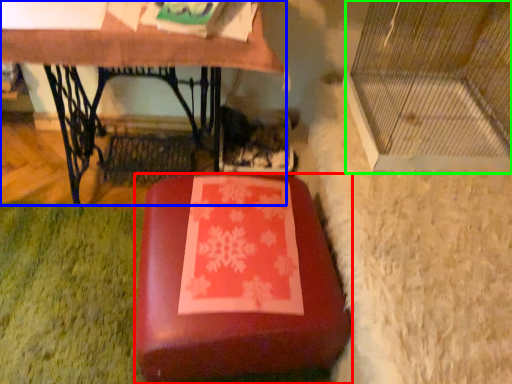
Question: Based on their relative distances, which object is farther from furniture (highlighted by a red box)? Choose from table (highlighted by a blue box) and glass door (highlighted by a green box).

Choices:
 (A) table
 (B) glass door

Answer: (A)